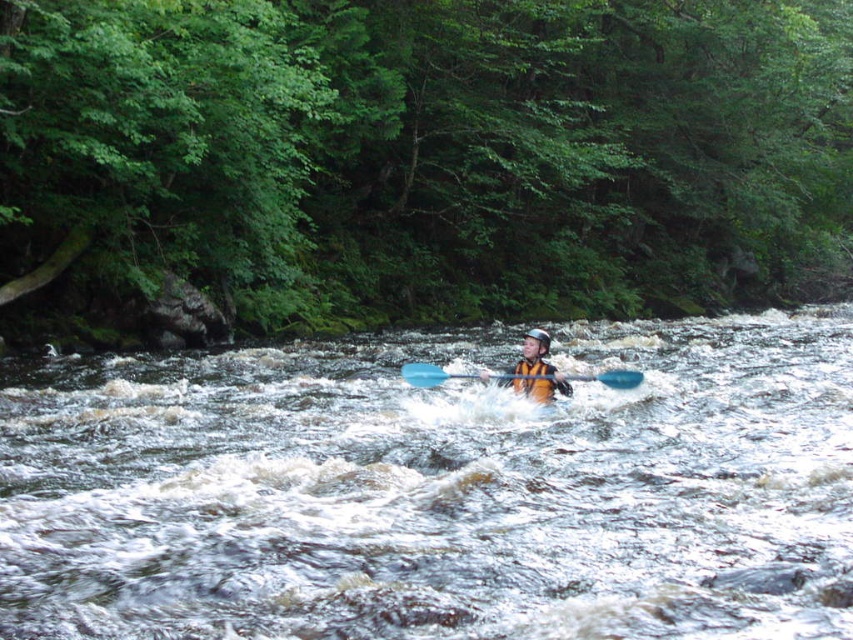
At what (x,y) coordinates should I click in order to perform the action: click on white frothy water at center. Please return your answer as a coordinate pair (x, y). Looking at the image, I should click on pyautogui.click(x=437, y=490).

Does point (718, 460) come behind point (416, 380)?

No, (718, 460) is closer to viewer.

I want to click on white frothy water at center, so click(437, 490).

Based on the photo, who is taller, yellow life jacket at center or blue plastic paddle at center?

blue plastic paddle at center is taller.

Based on the photo, who is shorter, yellow life jacket at center or blue plastic paddle at center?

yellow life jacket at center

Locate an element on the screen. Image resolution: width=853 pixels, height=640 pixels. yellow life jacket at center is located at coordinates (537, 369).

Does point (48, 490) come farther from viewer compared to point (521, 378)?

No, it is in front of (521, 378).

Which is in front, point (358, 369) or point (534, 371)?

Point (534, 371) is more forward.

The width and height of the screenshot is (853, 640). I want to click on white frothy water at center, so click(437, 490).